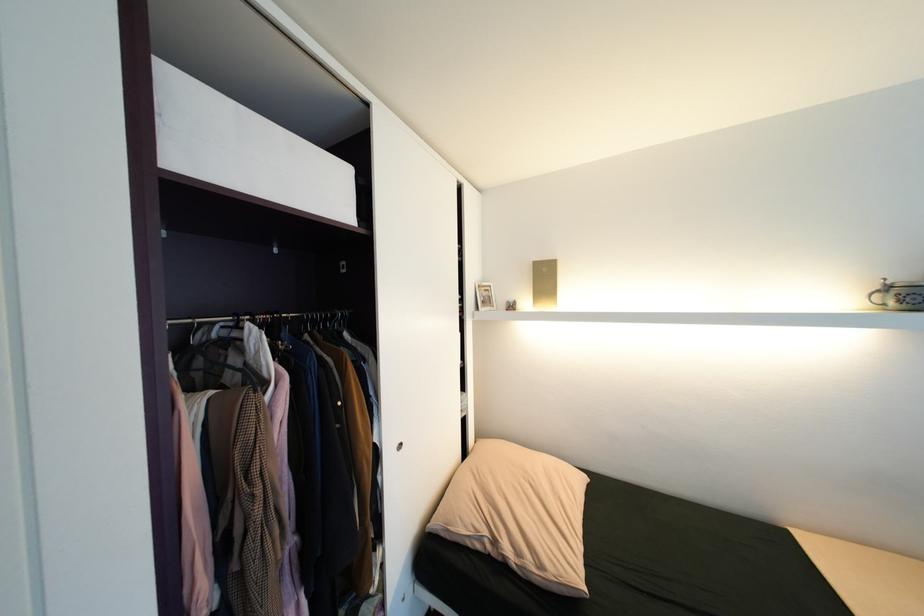
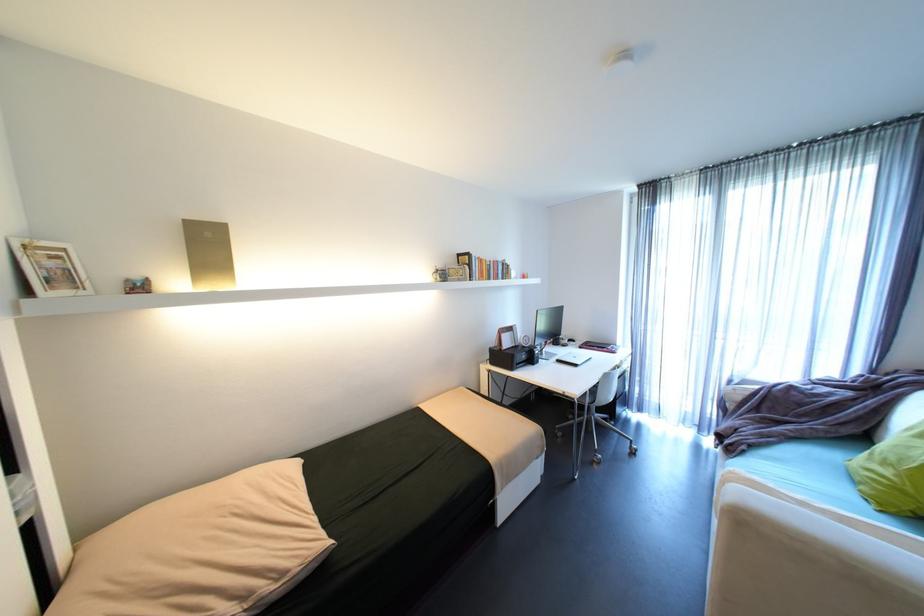
Find the pixel in the second image that matches the point at 550,567 in the first image.

(289, 575)